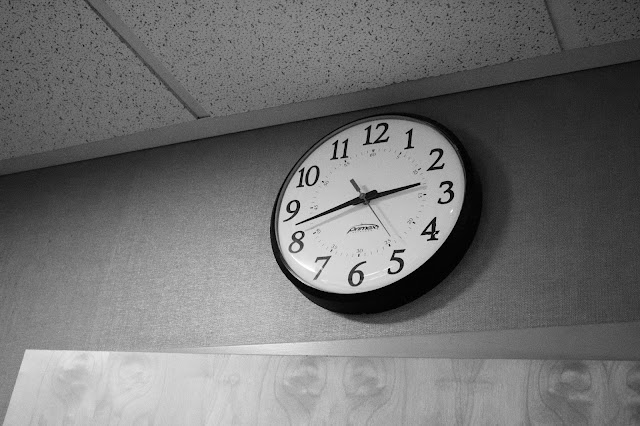
Where is `door top`? Image resolution: width=640 pixels, height=426 pixels. door top is located at coordinates (515, 396).